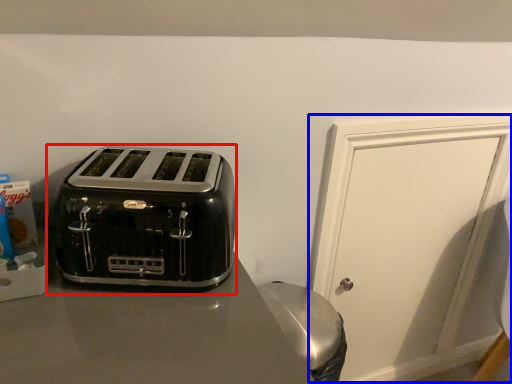
Question: Which of the following is the closest to the observer, toaster (highlighted by a red box) or door (highlighted by a blue box)?

Choices:
 (A) toaster
 (B) door

Answer: (A)